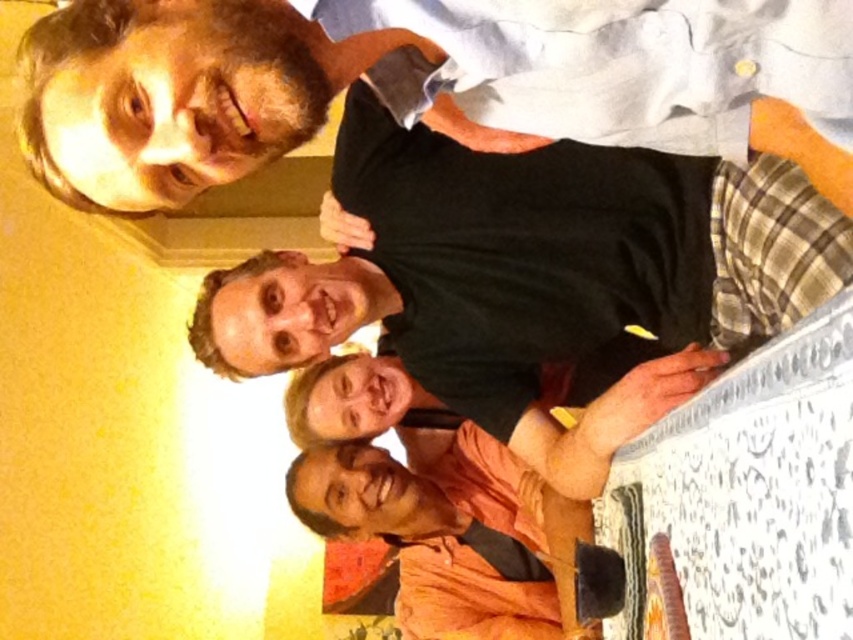
Question: Observing the image, what is the correct spatial positioning of black matte shirt at upper center in reference to matte black shirt at upper left?

Choices:
 (A) below
 (B) above

Answer: (A)

Question: Among these points, which one is nearest to the camera?

Choices:
 (A) (466, 113)
 (B) (386, 157)

Answer: (A)

Question: In this image, where is black matte shirt at upper center located relative to matte black shirt at upper left?

Choices:
 (A) right
 (B) left

Answer: (A)

Question: Can you confirm if black matte shirt at upper center is wider than matte black shirt at upper left?

Choices:
 (A) yes
 (B) no

Answer: (A)

Question: Among these objects, which one is farthest from the camera?

Choices:
 (A) matte black shirt at upper left
 (B) black matte shirt at upper center

Answer: (B)

Question: Which point is farther to the camera?

Choices:
 (A) black matte shirt at upper center
 (B) matte black shirt at upper left

Answer: (A)